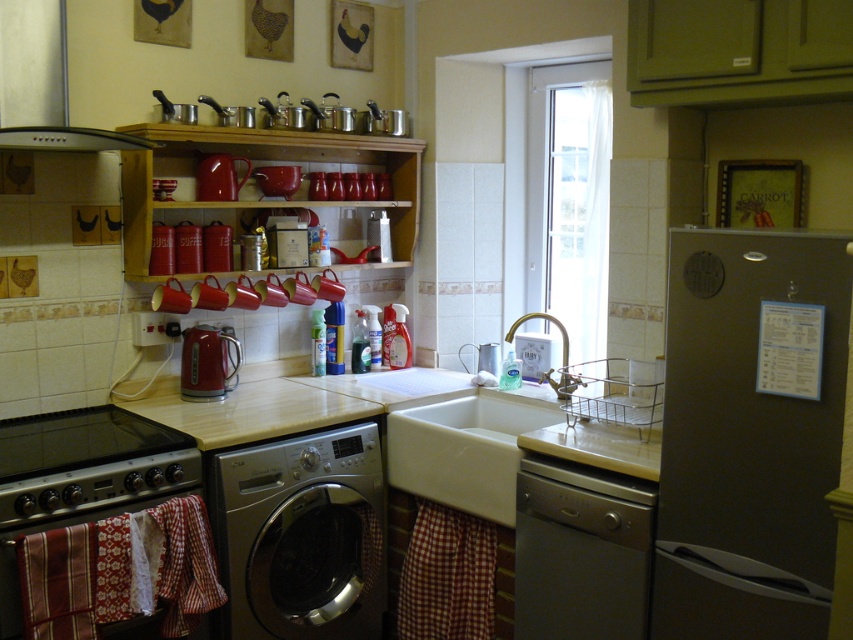
Locate an element on the screen. The width and height of the screenshot is (853, 640). white ceramic sink at center is located at coordinates (463, 449).

Locate an element on the screen. The image size is (853, 640). white ceramic sink at center is located at coordinates (463, 449).

Which is more to the right, silver metallic washing machine at lower center or white ceramic sink at center?

From the viewer's perspective, white ceramic sink at center appears more on the right side.

You are a GUI agent. You are given a task and a screenshot of the screen. Output one action in this format:
    pyautogui.click(x=<x>, y=<y>)
    Task: Click on the silver metallic washing machine at lower center
    The width and height of the screenshot is (853, 640).
    Given the screenshot: What is the action you would take?
    300,536

At what (x,y) coordinates should I click in order to perform the action: click on silver metallic washing machine at lower center. Please return your answer as a coordinate pair (x, y). The width and height of the screenshot is (853, 640). Looking at the image, I should click on (300, 536).

Is black glass stove at lower left smaller than shiny metallic kettle at center-left?

No, black glass stove at lower left is not smaller than shiny metallic kettle at center-left.

Is black glass stove at lower left taller than shiny metallic kettle at center-left?

No.

Between point (134, 472) and point (215, 346), which one is positioned behind?

The point (215, 346) is more distant.

In order to click on black glass stove at lower left in this screenshot , I will do `click(88, 464)`.